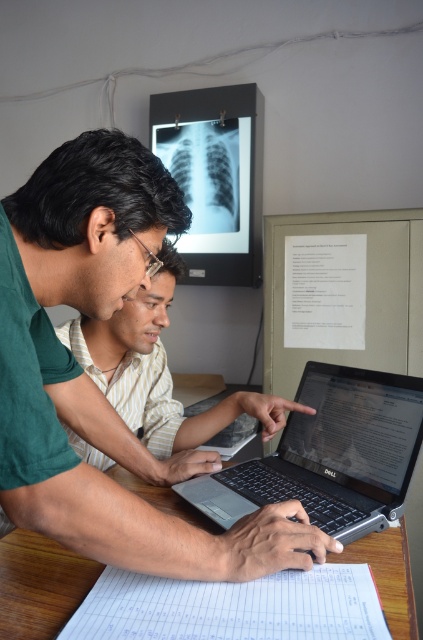
Question: Is satin black laptop at center below white paper at lower center?

Choices:
 (A) yes
 (B) no

Answer: (B)

Question: Which is nearer to the black matte laptop at center?

Choices:
 (A) white paper at lower center
 (B) green matte shirt at upper left
 (C) matte green shirt at center

Answer: (A)

Question: Which point is closer to the camera taking this photo?

Choices:
 (A) (181, 262)
 (B) (378, 481)
 (C) (359, 426)
 (D) (82, 579)

Answer: (D)

Question: Can you confirm if green matte shirt at upper left is positioned below matte green shirt at center?

Choices:
 (A) yes
 (B) no

Answer: (B)

Question: Which of the following is the closest to the observer?

Choices:
 (A) (121, 394)
 (B) (173, 502)

Answer: (B)

Question: Can you confirm if black matte laptop at center is positioned above white paper at lower center?

Choices:
 (A) yes
 (B) no

Answer: (A)